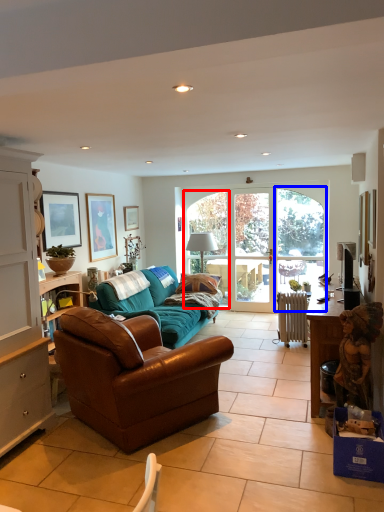
Question: Which object is closer to the camera taking this photo, window (highlighted by a red box) or glass door (highlighted by a blue box)?

Choices:
 (A) window
 (B) glass door

Answer: (B)